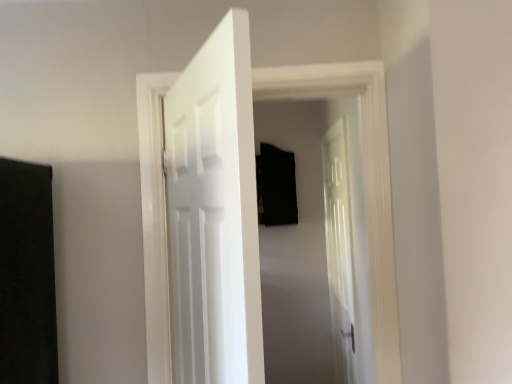
Question: Does white glossy door at center, arranged as the 3th door when viewed from the right, have a lesser width compared to white glossy door at center, the first door when ordered from back to front?

Choices:
 (A) yes
 (B) no

Answer: (A)

Question: Is white glossy door at center, the third door from the left, inside white glossy door at center, the first door in the front-to-back sequence?

Choices:
 (A) no
 (B) yes

Answer: (A)

Question: Considering the relative positions of white glossy door at center, arranged as the third door when viewed from the back, and white glossy door at center, placed as the first door when sorted from right to left, in the image provided, is white glossy door at center, arranged as the third door when viewed from the back, to the left of white glossy door at center, placed as the first door when sorted from right to left, from the viewer's perspective?

Choices:
 (A) no
 (B) yes

Answer: (B)

Question: Is white glossy door at center, arranged as the third door when viewed from the back, looking in the opposite direction of white glossy door at center, which is the third door from front to back?

Choices:
 (A) yes
 (B) no

Answer: (B)

Question: From the image's perspective, is white glossy door at center, which is the 1th door from left to right, on top of white glossy door at center, the first door when ordered from back to front?

Choices:
 (A) no
 (B) yes

Answer: (B)

Question: Considering the positions of point (152, 225) and point (211, 276), is point (152, 225) closer or farther from the camera than point (211, 276)?

Choices:
 (A) closer
 (B) farther

Answer: (B)

Question: From the image's perspective, is white wooden door at center, the 2th door viewed from the right, positioned above or below white glossy door at center, which is the 1th door from left to right?

Choices:
 (A) above
 (B) below

Answer: (A)

Question: From a real-world perspective, is white wooden door at center, arranged as the second door when viewed from the back, above or below white glossy door at center, the first door in the front-to-back sequence?

Choices:
 (A) below
 (B) above

Answer: (B)

Question: Considering the positions of white wooden door at center, the 2th door viewed from the right, and white glossy door at center, arranged as the third door when viewed from the back, in the image, is white wooden door at center, the 2th door viewed from the right, taller or shorter than white glossy door at center, arranged as the third door when viewed from the back,?

Choices:
 (A) short
 (B) tall

Answer: (B)

Question: Is white glossy door at center, placed as the first door when sorted from right to left, inside the boundaries of white glossy door at center, arranged as the third door when viewed from the back, or outside?

Choices:
 (A) outside
 (B) inside

Answer: (A)

Question: From the image's perspective, relative to white glossy door at center, arranged as the third door when viewed from the back, is white glossy door at center, which is the third door from front to back, above or below?

Choices:
 (A) above
 (B) below

Answer: (B)

Question: Looking at their shapes, would you say white glossy door at center, which is the third door from front to back, is wider or thinner than white glossy door at center, arranged as the 3th door when viewed from the right?

Choices:
 (A) wide
 (B) thin

Answer: (A)

Question: Would you say white glossy door at center, which is the third door from front to back, is to the left or to the right of white glossy door at center, arranged as the 3th door when viewed from the right, in the picture?

Choices:
 (A) right
 (B) left

Answer: (A)

Question: Is white glossy door at center, the first door in the front-to-back sequence, wider or thinner than white glossy door at center, placed as the first door when sorted from right to left?

Choices:
 (A) wide
 (B) thin

Answer: (B)

Question: In terms of size, does white glossy door at center, which is the 1th door from left to right, appear bigger or smaller than white glossy door at center, the first door when ordered from back to front?

Choices:
 (A) small
 (B) big

Answer: (A)